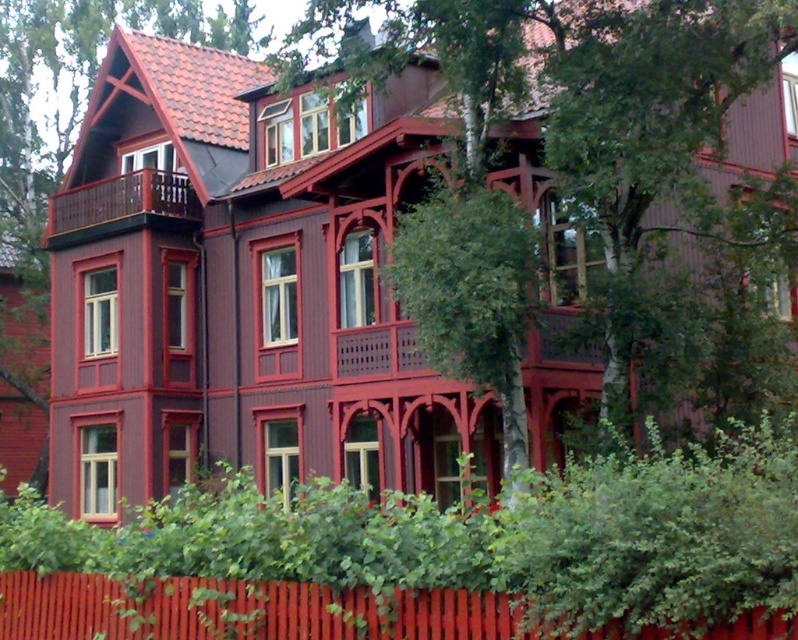
Question: Which object is farther from the camera taking this photo?

Choices:
 (A) green leafy tree at center
 (B) brown wooden balcony at left
 (C) smooth wooden fence at lower center

Answer: (B)

Question: Which of the following is the closest to the observer?

Choices:
 (A) brown wooden balcony at left
 (B) smooth wooden fence at lower center
 (C) green leafy tree at center

Answer: (B)

Question: In this image, where is green leafy tree at center located relative to brown wooden balcony at left?

Choices:
 (A) above
 (B) below

Answer: (B)

Question: Which of the following is the farthest from the observer?

Choices:
 (A) brown wooden balcony at left
 (B) green leafy tree at center
 (C) smooth wooden fence at lower center

Answer: (A)

Question: Does smooth wooden fence at lower center have a greater width compared to green leafy tree at center?

Choices:
 (A) no
 (B) yes

Answer: (B)

Question: Does green leafy tree at center appear under brown wooden balcony at left?

Choices:
 (A) no
 (B) yes

Answer: (B)